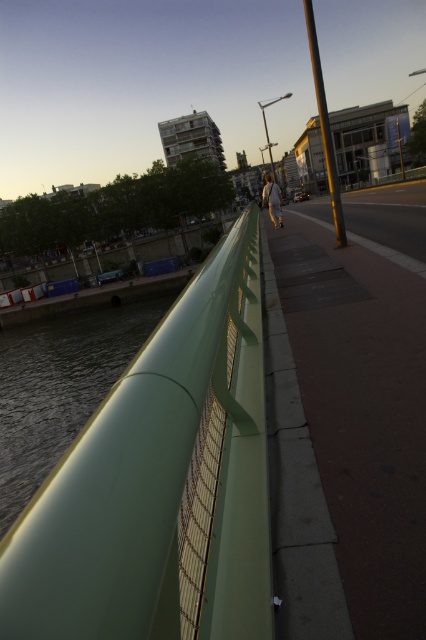
Question: Which object appears closest to the camera in this image?

Choices:
 (A) green matte railing at lower left
 (B) green matte railing at center

Answer: (B)

Question: Among these points, which one is farthest from the camera?

Choices:
 (A) (270, 205)
 (B) (37, 538)
 (C) (92, 336)

Answer: (C)

Question: Which point is farther from the camera taking this photo?

Choices:
 (A) (172, 520)
 (B) (276, 195)
 (C) (25, 392)

Answer: (C)

Question: Is green matte railing at center above dark gray concrete pavement at center?

Choices:
 (A) no
 (B) yes

Answer: (A)

Question: Can you confirm if green matte railing at center is positioned above dark gray concrete pavement at center?

Choices:
 (A) no
 (B) yes

Answer: (A)

Question: Is dark gray concrete pavement at center positioned before green matte railing at lower left?

Choices:
 (A) yes
 (B) no

Answer: (A)